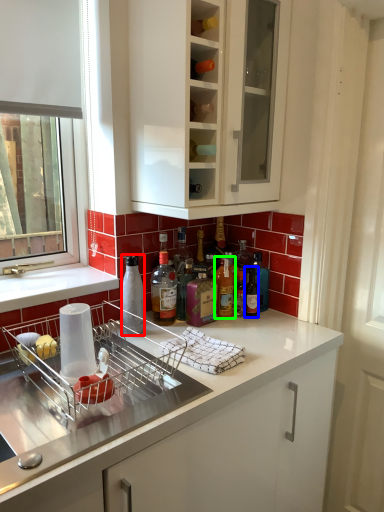
Question: Which object is positioned closest to bottle (highlighted by a red box)? Select from bottle (highlighted by a blue box) and bottle (highlighted by a green box).

Choices:
 (A) bottle
 (B) bottle

Answer: (B)